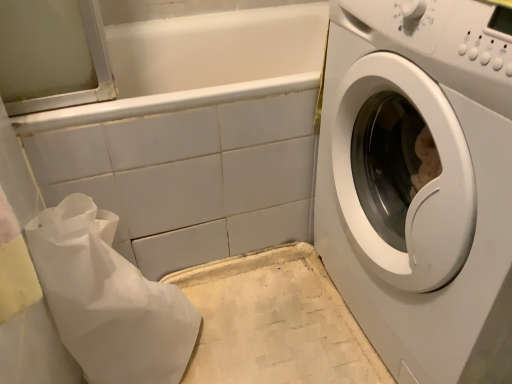
Question: Is white glossy bathtub at upper center inside or outside of white glossy washing machine at right?

Choices:
 (A) outside
 (B) inside

Answer: (A)

Question: Is white glossy bathtub at upper center taller or shorter than white glossy washing machine at right?

Choices:
 (A) short
 (B) tall

Answer: (A)

Question: Estimate the real-world distances between objects in this image. Which object is farther from the white glossy bathtub at upper center?

Choices:
 (A) white glossy washing machine at right
 (B) white paper bag at lower left
 (C) white textured mat at lower center

Answer: (A)

Question: Considering the real-world distances, which object is farthest from the white paper bag at lower left?

Choices:
 (A) white glossy washing machine at right
 (B) white textured mat at lower center
 (C) white glossy bathtub at upper center

Answer: (A)